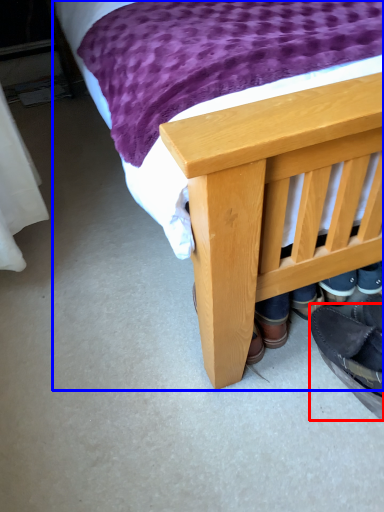
Question: Which point is further to the camera, footwear (highlighted by a red box) or bed (highlighted by a blue box)?

Choices:
 (A) footwear
 (B) bed

Answer: (A)